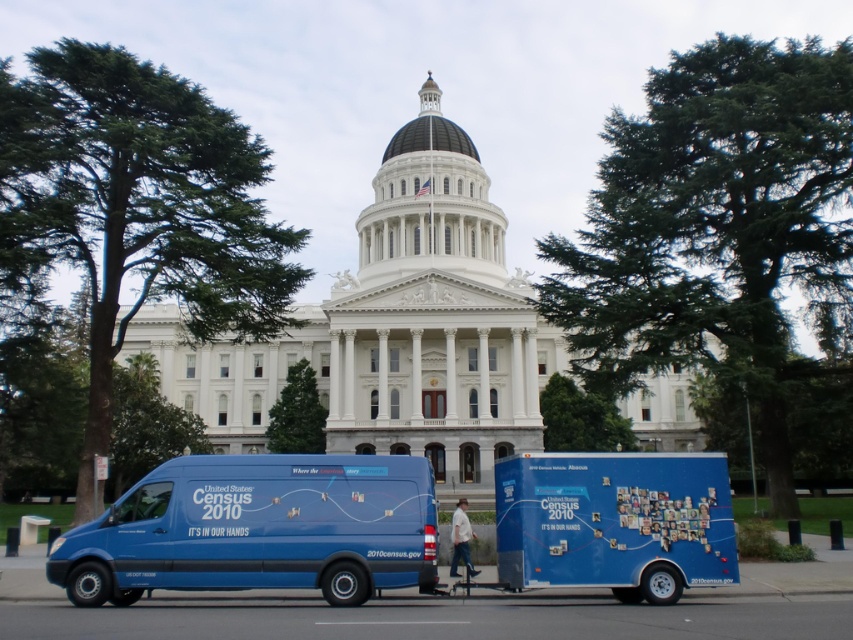
You are standing at the entrance of the white building with a dome and want to park your car in the closest available spot. The blue matte van at center is currently parked. Based on its position, can you estimate how far you are from the van?

The blue matte van at center is located at point (258,529), so you are approximately 0.828 meters away from the van in the x direction and 0.304 meters in the y direction.

You are a delivery driver who needs to park your truck, which is 2.5 meters wide, in the parking lot near the blue matte van at center and blue matte trailer at lower right. Based on the vehicles in the scene, can you determine if your truck will fit in the parking space between them?

The blue matte van at center is wider than the blue matte trailer at lower right. Since the van is wider, the parking space between them might be narrower than the van itself. However, without knowing the exact distance between the vehicles, it is uncertain if the 2.5 meter wide truck will fit. You should measure the space before deciding.

You are a pedestrian standing on the sidewalk in front of the white building with a dome. You see the blue matte van at center and the blue matte trailer at lower right. Which vehicle is nearer to you?

The blue matte van at center is closer to you than the blue matte trailer at lower right.